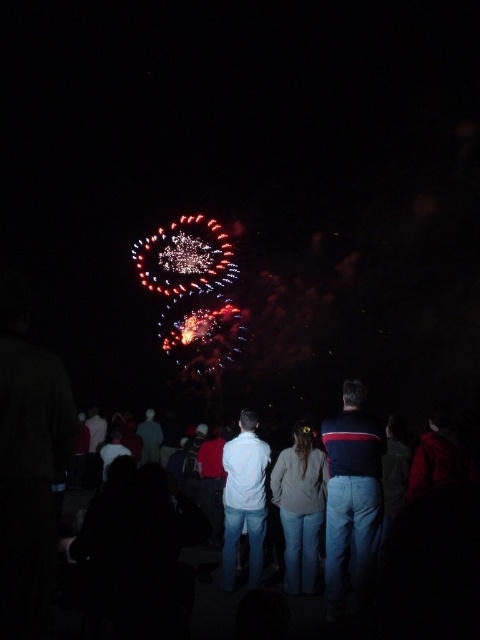
You are a photographer trying to capture the crowd while focusing on the jeans at center and the white matte shirt at center. Which clothing item should you zoom in on to ensure it takes up more space in your photo?

The jeans at center has a larger size compared to the white matte shirt at center, so zooming in on the jeans at center will ensure it takes up more space in the photo.

You are standing at the edge of the crowd watching the fireworks. You need to hand a small gift to someone wearing the dark blue striped sweater at center and then to someone wearing the white matte shirt at center. If you are currently at the starting point, which person should you approach first to minimize the distance you walk?

You should approach the dark blue striped sweater at center first because it is closer to your starting position than the white matte shirt at center. After giving the gift to the dark blue striped sweater at center, you can then proceed to the white matte shirt at center, which is farther away by 42.51 feet.

You are a photographer trying to capture a group photo of the jeans at center and the white matte shirt at center. If you want to ensure both are fully visible in the frame without cropping any part of them, which object should determine the frame width?

The jeans at center should determine the frame width because its width surpasses that of the white matte shirt at center, ensuring both fit without cropping.